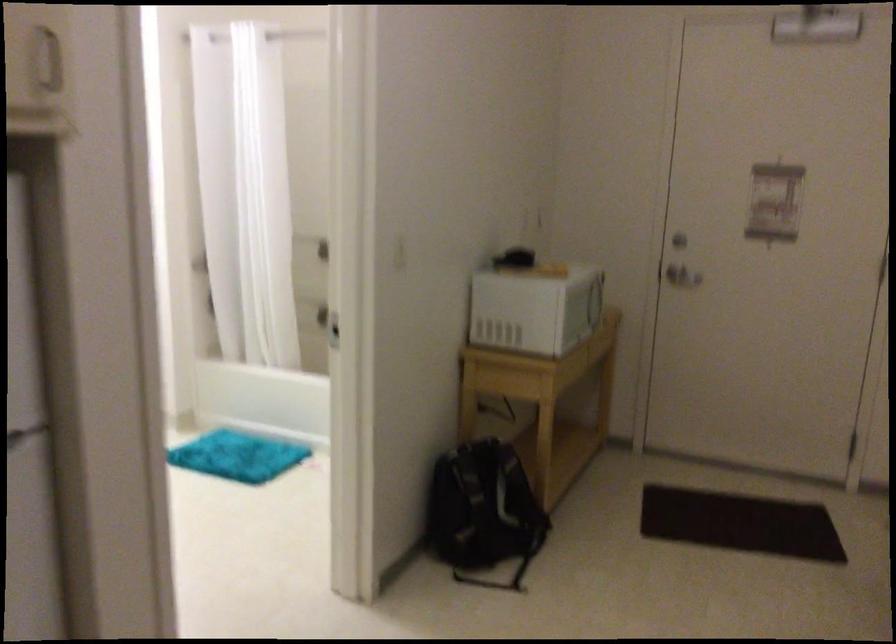
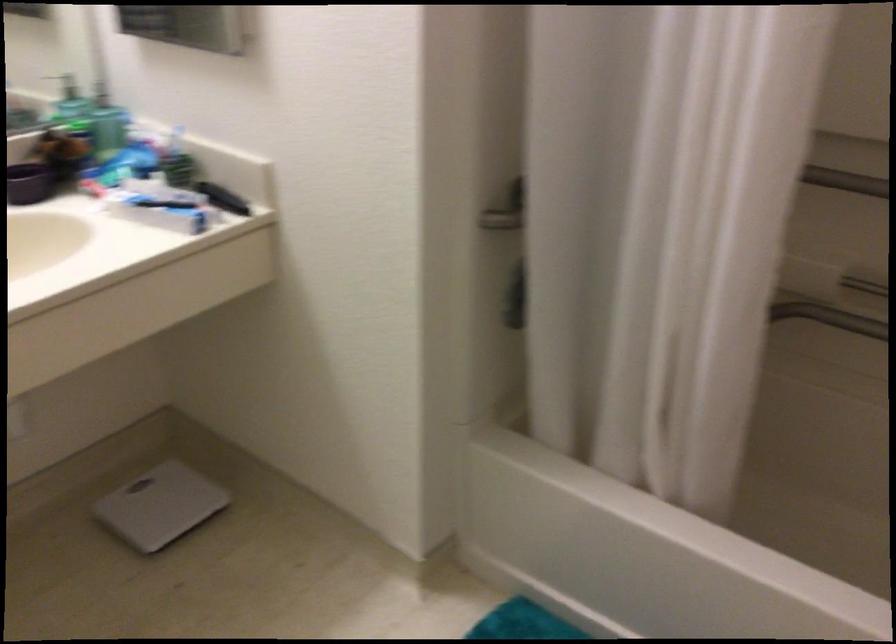
Question: I am providing you with two images of the same scene from different viewpoints. Please identify which objects are invisible in image2.

Choices:
 (A) adjustable spotlight
 (B) white bathroom scale
 (C) dispenser pump
 (D) shower faucet handle

Answer: (D)